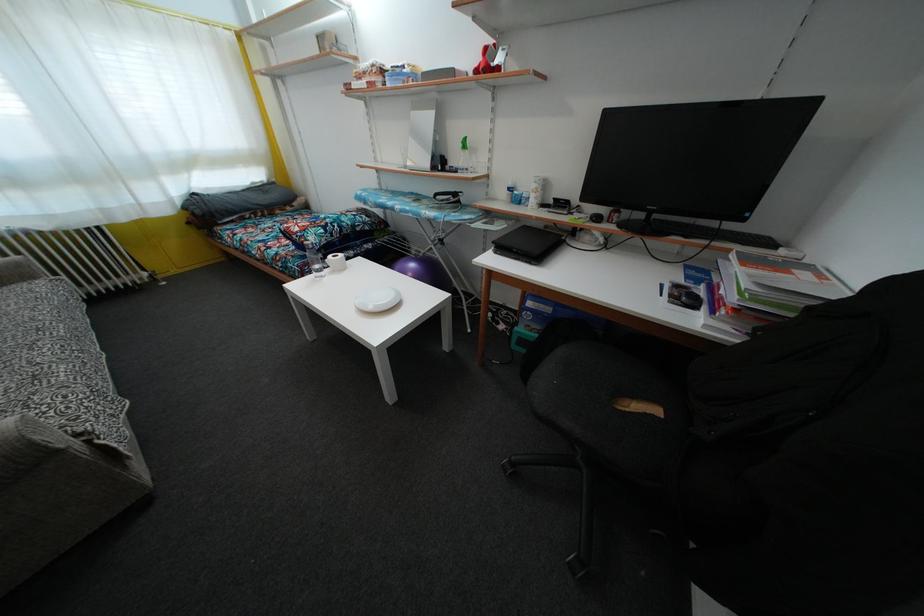
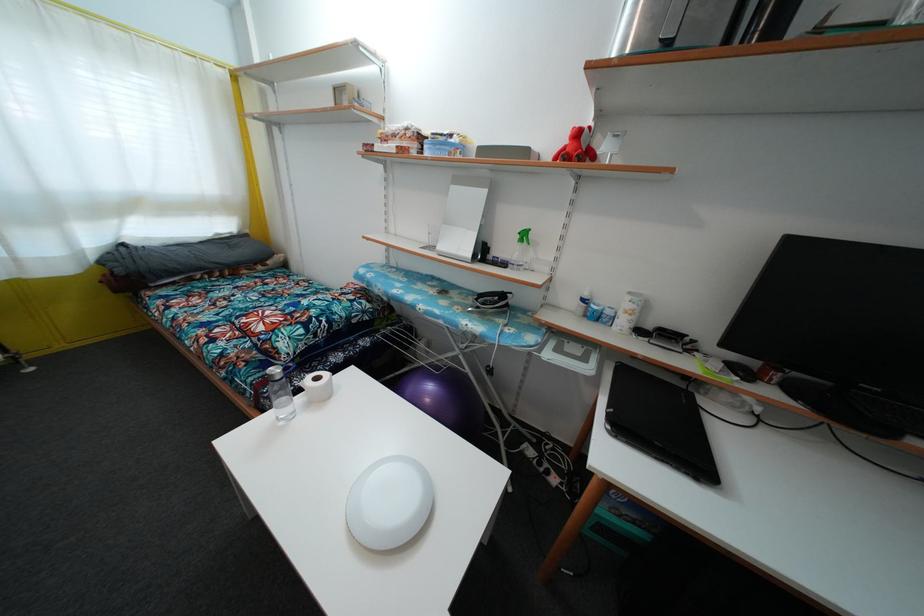
The point at (468,150) is marked in the first image. Where is the corresponding point in the second image?

(528, 241)